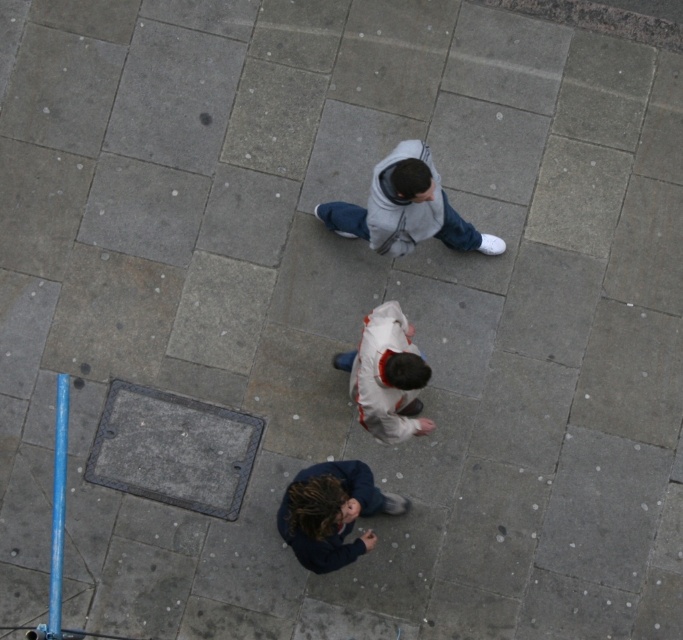
How far apart are the dark blue fleece jacket at lower center and the other two individuals?

The dark blue fleece jacket at lower center is 18.71 feet away from the other two individuals.

You are standing at the bottom of the image and want to reach the blue pole on the left. Which person wearing either the gray fleece jacket at upper center or the dark blue fleece jacket at lower center is closer to your starting position?

The dark blue fleece jacket at lower center is closer to your starting position because it is positioned below the gray fleece jacket at upper center.